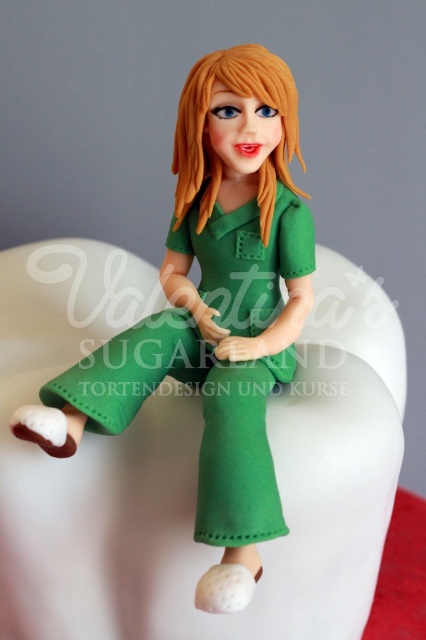
Question: Among these objects, which one is farthest from the camera?

Choices:
 (A) blonde glossy hair at center
 (B) matte green dress at center

Answer: (A)

Question: Among these objects, which one is nearest to the camera?

Choices:
 (A) matte green dress at center
 (B) blonde glossy hair at center

Answer: (A)

Question: Can you confirm if matte green dress at center is positioned to the right of blonde glossy hair at center?

Choices:
 (A) no
 (B) yes

Answer: (A)

Question: Is matte green dress at center further to the viewer compared to blonde glossy hair at center?

Choices:
 (A) yes
 (B) no

Answer: (B)

Question: Is matte green dress at center to the right of blonde glossy hair at center from the viewer's perspective?

Choices:
 (A) no
 (B) yes

Answer: (A)